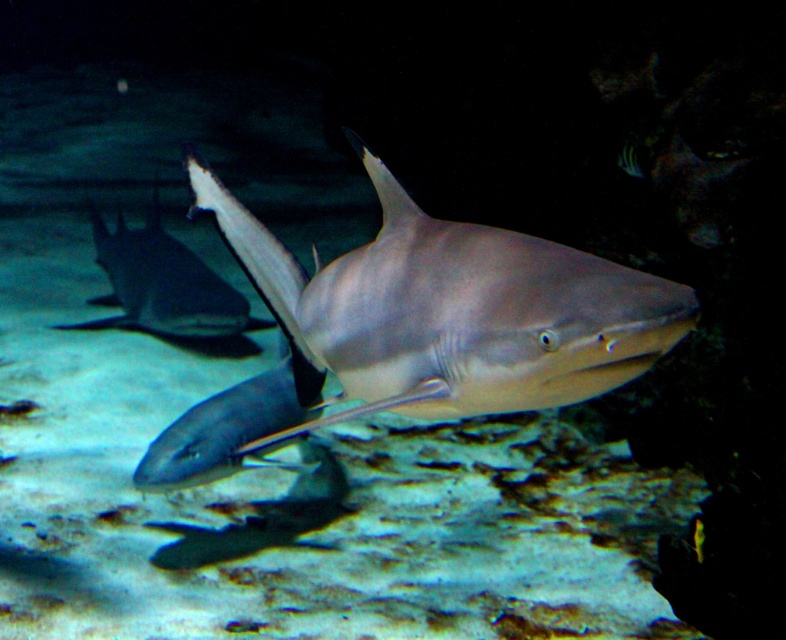
You are a marine biologist observing two sharks in an underwater scene. The sharks are the smooth gray shark at center and the second shark in the background. You need to place a 36 inch measuring tape between them to measure the distance. Will the tape be long enough?

The smooth gray shark at center and the second shark in the background are 36.08 inches apart. The 36 inch measuring tape is slightly shorter than the distance between them, so it will not be long enough.

You are a marine biologist observing an underwater scene. You notice a point at coordinates point (417,326). What object is located at that point?

The smooth gray shark at center is located at point (417,326).

You are a marine biologist observing underwater life. You notice two creatures at the center of your viewfinder, a smooth gray shark at center and a smooth gray stingray at center. You need to place a 2 meter long measuring tape between them to study their spacing. Will the measuring tape reach from one to the other without bending?

The distance between the smooth gray shark at center and the smooth gray stingray at center is 1.72 meters. Since the measuring tape is 2 meters long, it will easily reach between them without needing to bend.